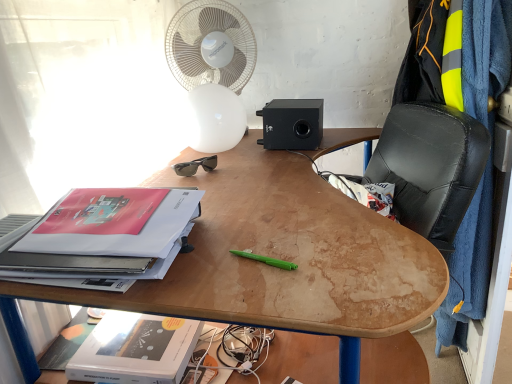
You are a GUI agent. You are given a task and a screenshot of the screen. Output one action in this format:
    pyautogui.click(x=<x>, y=<y>)
    Task: Click on the free space in front of green plastic pen at center
    The image size is (512, 384).
    Given the screenshot: What is the action you would take?
    pyautogui.click(x=278, y=293)